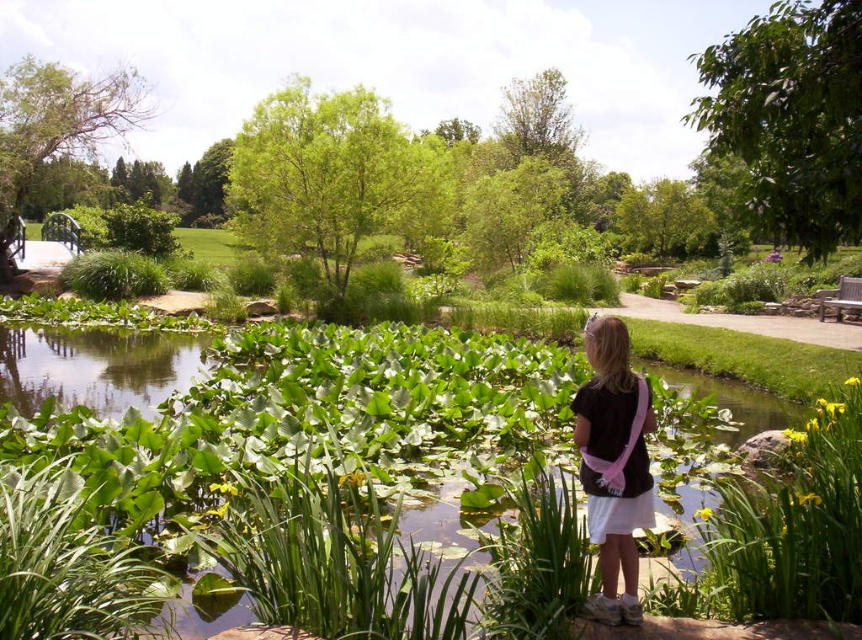
Does green leafy water at center come behind black matte shirt at center?

Yes, it is behind black matte shirt at center.

Can you confirm if green leafy water at center is positioned to the right of black matte shirt at center?

In fact, green leafy water at center is to the left of black matte shirt at center.

What do you see at coordinates (291, 406) in the screenshot? I see `green leafy water at center` at bounding box center [291, 406].

Locate an element on the screen. green leafy water at center is located at coordinates (291, 406).